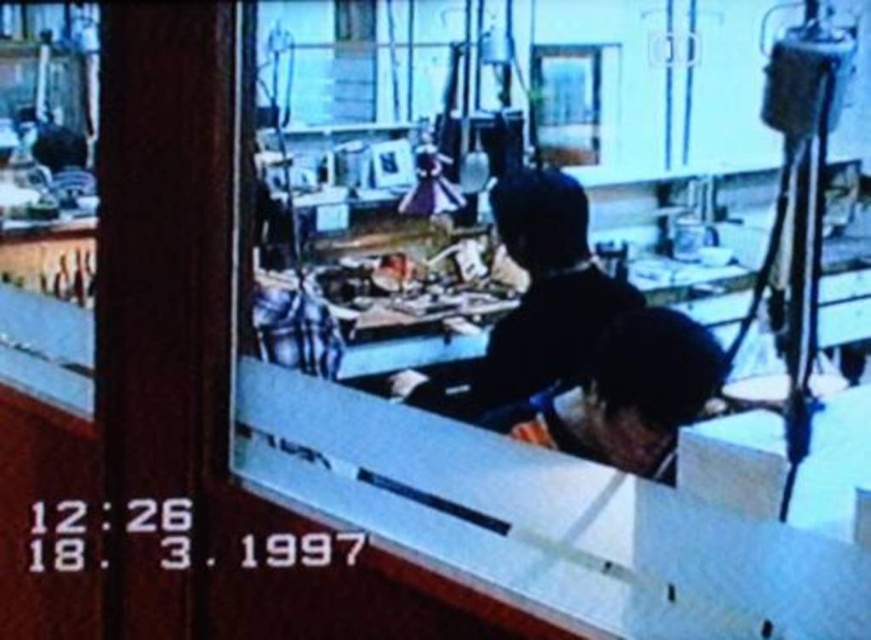
Is point (568, 369) farther from camera compared to point (650, 451)?

That is True.

Is point (542, 353) closer to camera compared to point (643, 392)?

No, (542, 353) is further to viewer.

Locate an element on the screen. This screenshot has width=871, height=640. black matte jacket at center is located at coordinates [x=545, y=289].